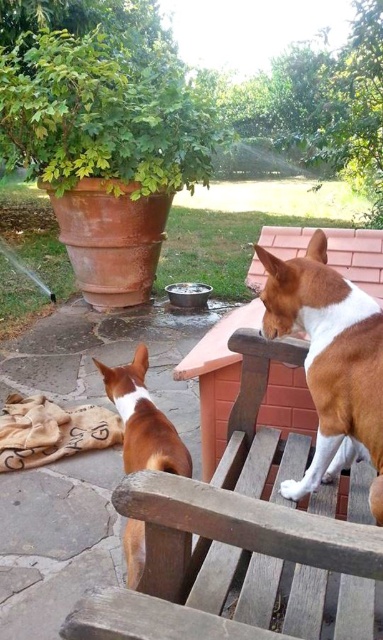
You are standing in the garden and want to walk from the wooden park bench at lower left to the brown smooth dog at upper right. Which direction should you move relative to the bench?

You should move to the right relative to the wooden park bench at lower left to reach the brown smooth dog at upper right because the brown smooth dog at upper right is located to the right of the wooden park bench at lower left.

You are standing at point (253, 547) and want to throw a ball to the other dog. The distance between you and the dog is 29.80 inches. If the dog can jump 30 inches high, will it be able to catch the ball?

The distance between you and the dog is 29.80 inches, which is slightly less than the dog can jump. The dog can jump 30 inches high, so it will be able to catch the ball.

You are standing at the camera position and see two points in the image. Which point, point (x=289, y=298) or point (x=191, y=468), is closer to you?

Point (x=289, y=298) is in front of point (x=191, y=468), so it is closer to you.